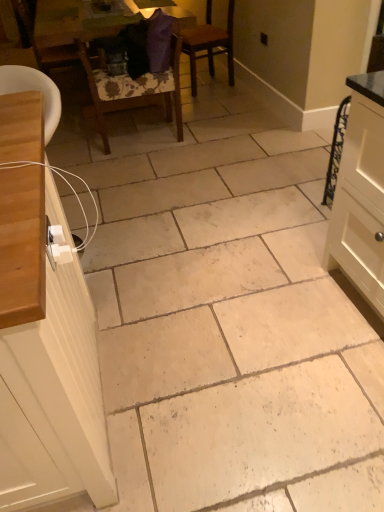
Identify the location of unoccupied area in front of wooden chair at center, the 2th chair in the left-to-right sequence. This screenshot has height=512, width=384. (144, 166).